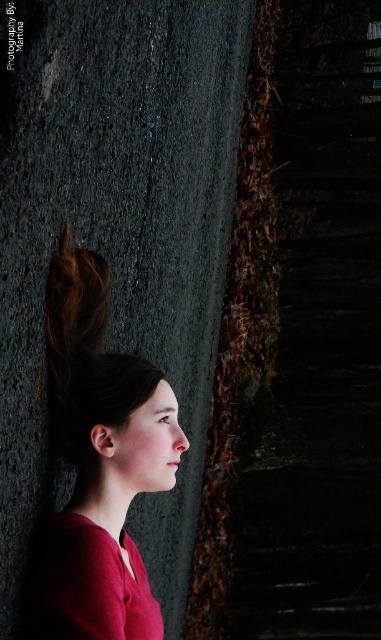
You are a photographer adjusting your camera settings. You need to ensure that both the matte red shirt at left and the dark brown silky hair at center are in focus. Given that your camera has a depth of field that can cover 4 inches, will both subjects be in focus?

The matte red shirt at left and dark brown silky hair at center are 4.30 inches apart. Since the distance between them exceeds the camera depth of field of 4 inches, they may not both be in focus simultaneously.

You are a photographer trying to capture a portrait of the person in the image. You want to ensure the matte red shirt at left is visible without being blocked by the dark brown silky hair at center. Based on the scene description, is this possible?

Yes, the matte red shirt at left is in front of the dark brown silky hair at center, so it will be visible and not blocked by the hair.

You are an artist sketching a scene and need to locate the matte red shirt at left. According to the coordinates provided, where exactly should you place it on your drawing canvas?

The matte red shirt at left should be placed at the coordinates point (99, 465) on the drawing canvas.